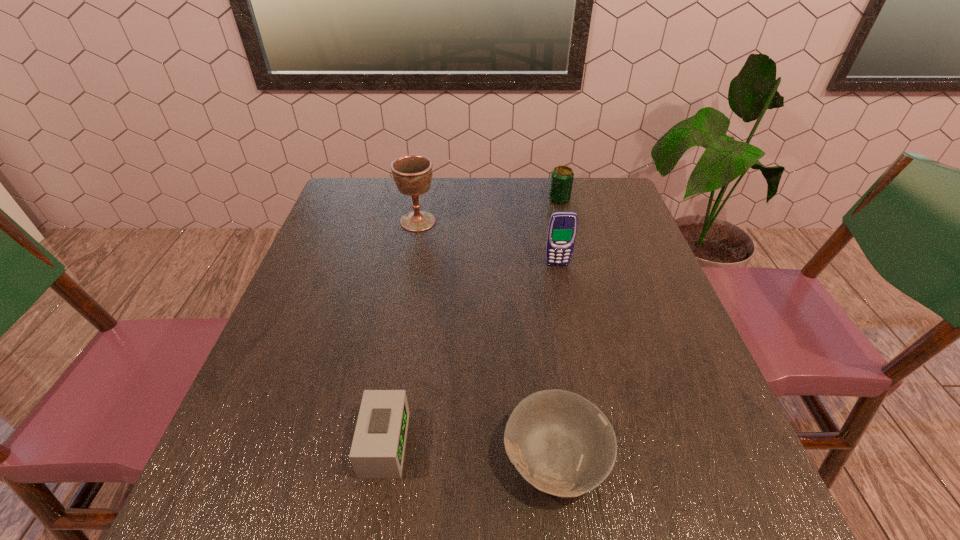
Find the location of a particular element. The height and width of the screenshot is (540, 960). object that is the second closest one to the third farthest object is located at coordinates (412, 174).

At what (x,y) coordinates should I click in order to perform the action: click on object that stands as the closest to the third tallest object. Please return your answer as a coordinate pair (x, y). The image size is (960, 540). Looking at the image, I should click on (562, 228).

What are the coordinates of `vacant space that satisfies the following two spatial constraints: 1. on the front side of the shortest object; 2. on the right side of the chalice` in the screenshot? It's located at (375, 457).

Find the location of a particular element. vacant space that satisfies the following two spatial constraints: 1. on the front-facing side of the alarm clock; 2. on the left side of the shortest object is located at coordinates (382, 457).

The width and height of the screenshot is (960, 540). Find the location of `vacant space that satisfies the following two spatial constraints: 1. on the front side of the second farthest object; 2. on the left side of the bowl`. vacant space that satisfies the following two spatial constraints: 1. on the front side of the second farthest object; 2. on the left side of the bowl is located at coordinates (375, 457).

Identify the location of vacant area that satisfies the following two spatial constraints: 1. on the front-facing side of the alarm clock; 2. on the left side of the shortest object. (382, 457).